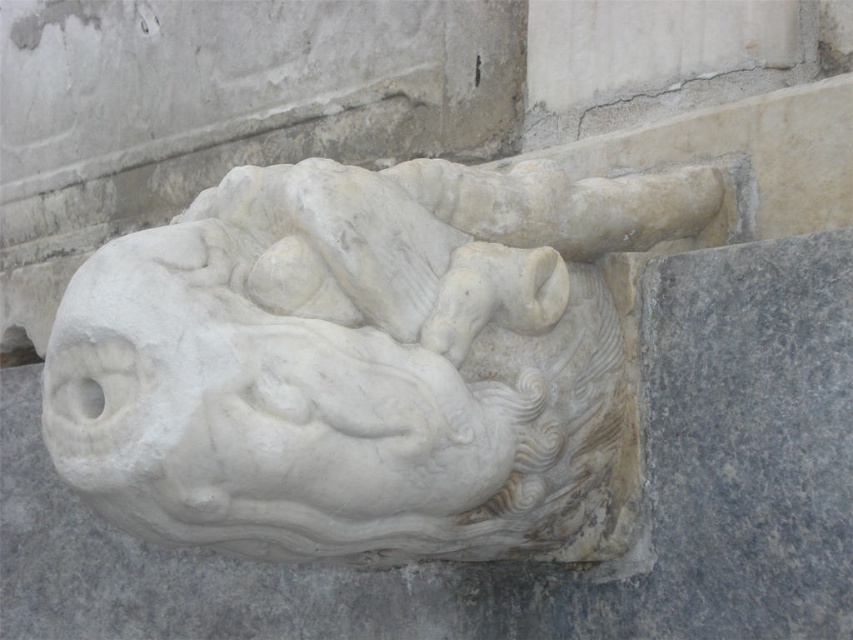
Question: Which point is farther to the camera?

Choices:
 (A) (93, 352)
 (B) (567, 556)

Answer: (B)

Question: Among these points, which one is nearest to the camera?

Choices:
 (A) (125, 444)
 (B) (358, 328)

Answer: (A)

Question: Can you confirm if white marble horse at center is positioned to the left of white marble horse head at center?

Choices:
 (A) yes
 (B) no

Answer: (B)

Question: Can you confirm if white marble horse at center is positioned to the left of white marble horse head at center?

Choices:
 (A) yes
 (B) no

Answer: (B)

Question: Does white marble horse at center appear on the left side of white marble horse head at center?

Choices:
 (A) yes
 (B) no

Answer: (B)